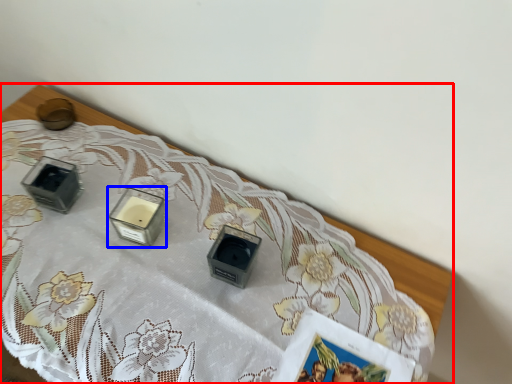
Question: Which of the following is the farthest to the observer, table (highlighted by a red box) or candle holder (highlighted by a blue box)?

Choices:
 (A) table
 (B) candle holder

Answer: (B)